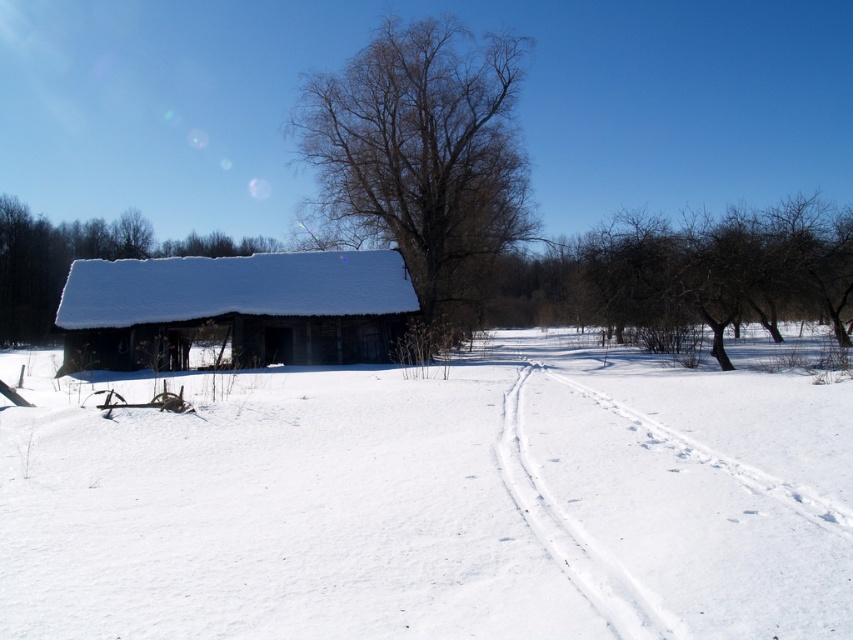
You are standing at the entrance of the rustic wooden structure covered in snow. You see the white snow track at lower right and the bare wood tree at center. Which object is closer to you?

The white snow track at lower right is closer to you because it is in front of the bare wood tree at center.

You are standing in front of the rustic wooden structure and want to walk to the white snow track at lower right. Which direction should you head relative to the bare wood tree at center?

You should head below the bare wood tree at center because the white snow track at lower right is located below it.